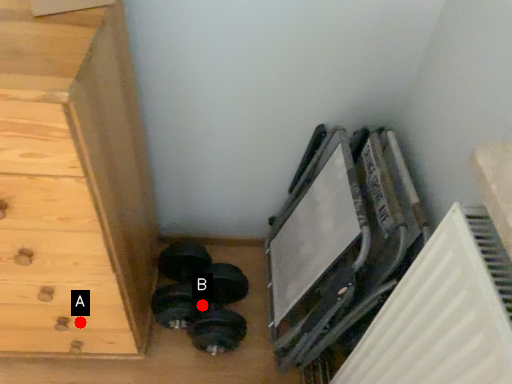
Question: Two points are circled on the image, labeled by A and B beside each circle. Among these points, which one is nearest to the camera?

Choices:
 (A) A is closer
 (B) B is closer

Answer: (A)